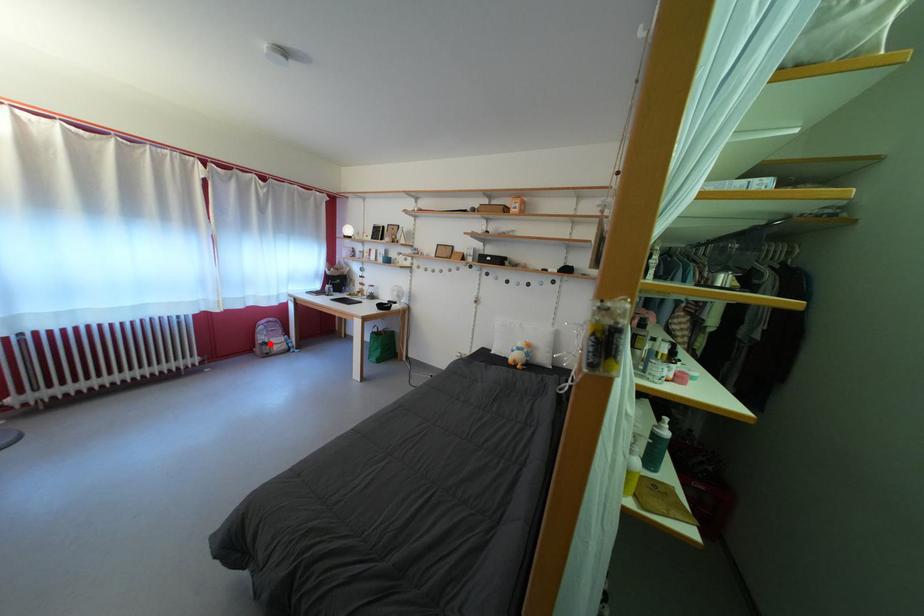
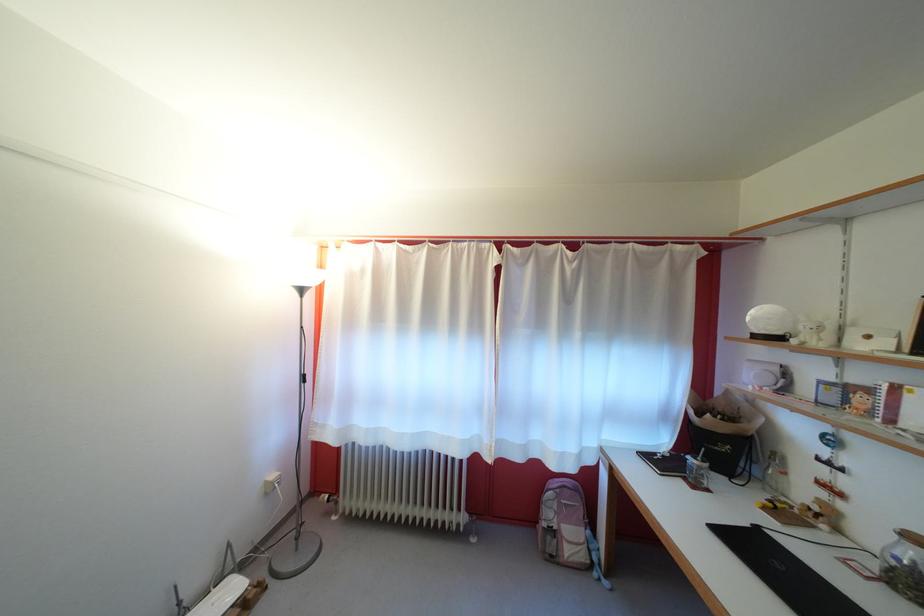
Locate, in the second image, the point that corresponds to the highlighted location in the first image.

(556, 521)